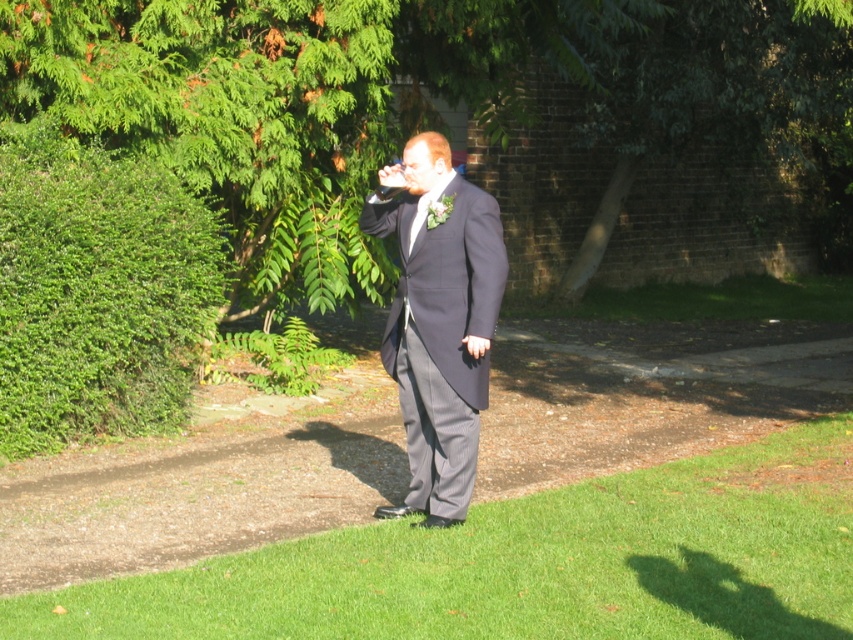
Which is above, green leafy tree at upper left or green leafy hedge at left?

Positioned higher is green leafy tree at upper left.

This screenshot has height=640, width=853. Identify the location of green leafy tree at upper left. (409, 99).

I want to click on green leafy tree at upper left, so click(x=409, y=99).

Can you confirm if green leafy tree at upper left is shorter than green grass at lower center?

Incorrect, green leafy tree at upper left's height does not fall short of green grass at lower center's.

Does green leafy tree at upper left lie behind green grass at lower center?

Yes, it is behind green grass at lower center.

Who is more distant from viewer, (111,10) or (392,522)?

Positioned behind is point (111,10).

Identify the location of green leafy tree at upper left. The height and width of the screenshot is (640, 853). (409, 99).

Who is taller, green grass at lower center or green leafy hedge at left?

green leafy hedge at left is taller.

Who is more forward, (531, 600) or (56, 268)?

Point (531, 600) is more forward.

In order to click on green grass at lower center in this screenshot , I will do `click(531, 563)`.